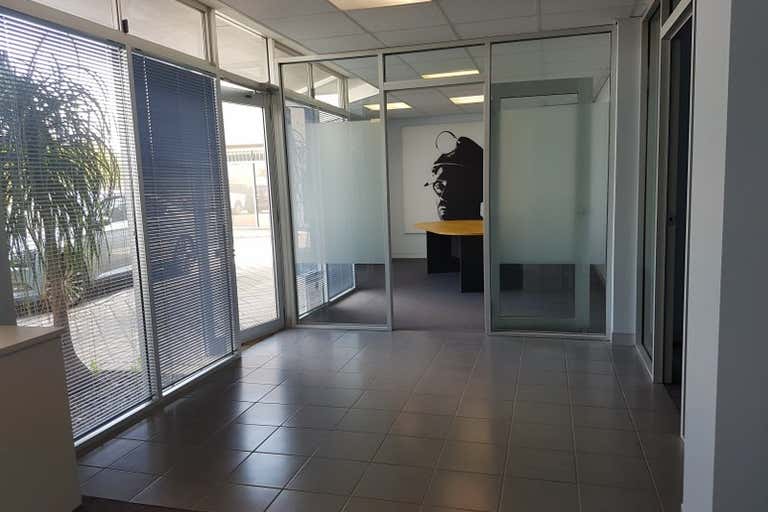
This screenshot has height=512, width=768. Find the location of `grey tile floor`. grey tile floor is located at coordinates (416, 435).